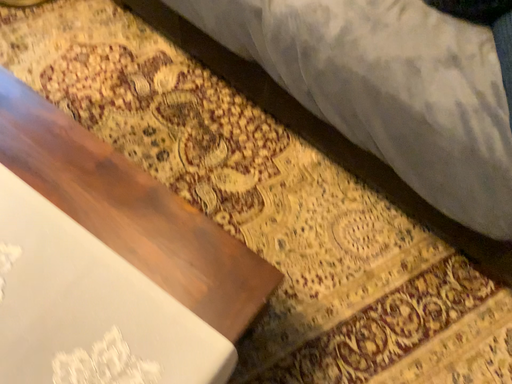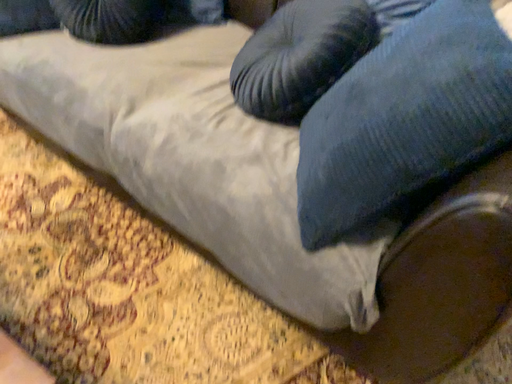
Question: Which way did the camera rotate in the video?

Choices:
 (A) rotated upward
 (B) rotated downward

Answer: (A)